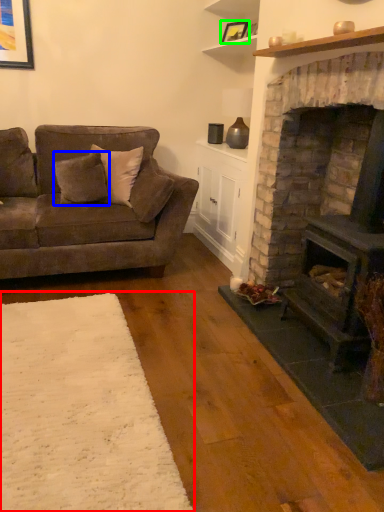
Question: Which object is the closest to the plain (highlighted by a red box)? Choose among these: pillow (highlighted by a blue box) or picture frame (highlighted by a green box).

Choices:
 (A) pillow
 (B) picture frame

Answer: (A)